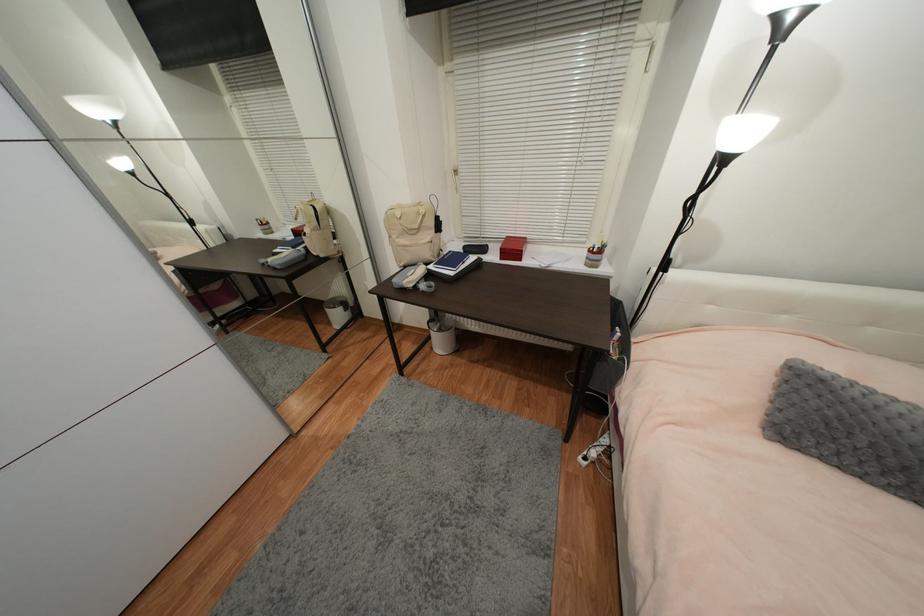
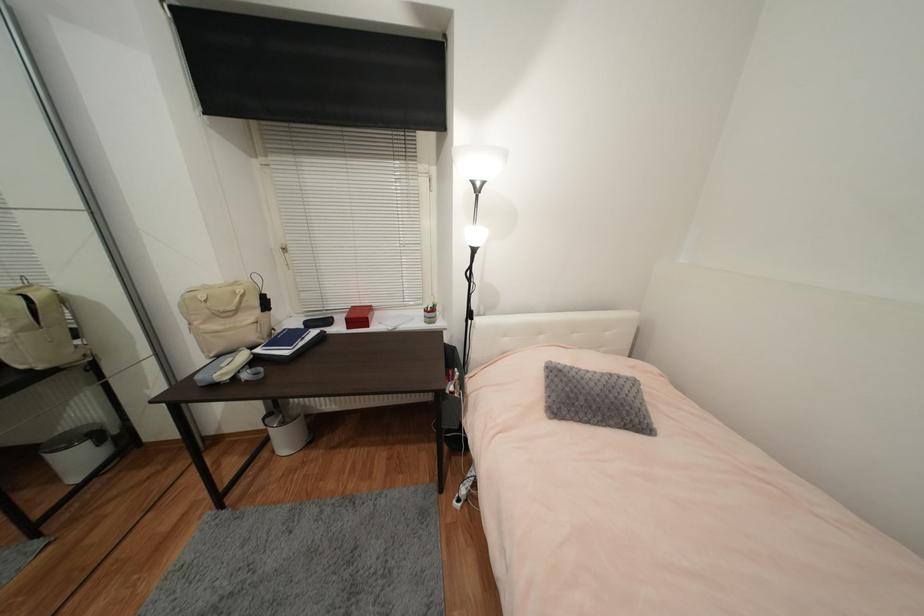
Locate, in the second image, the point that corresponds to point 517,251 in the first image.

(363, 318)